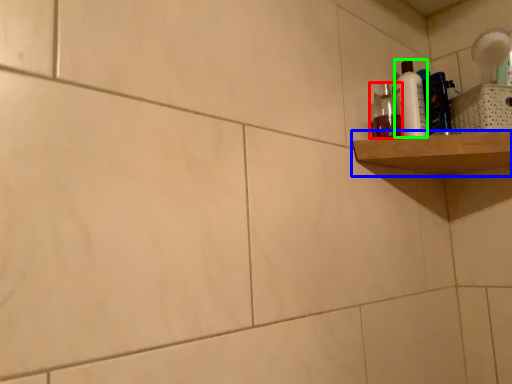
Question: Which object is positioned closest to mouthwash (highlighted by a red box)? Select from shelf (highlighted by a blue box) and cleaning product (highlighted by a green box).

Choices:
 (A) shelf
 (B) cleaning product

Answer: (B)